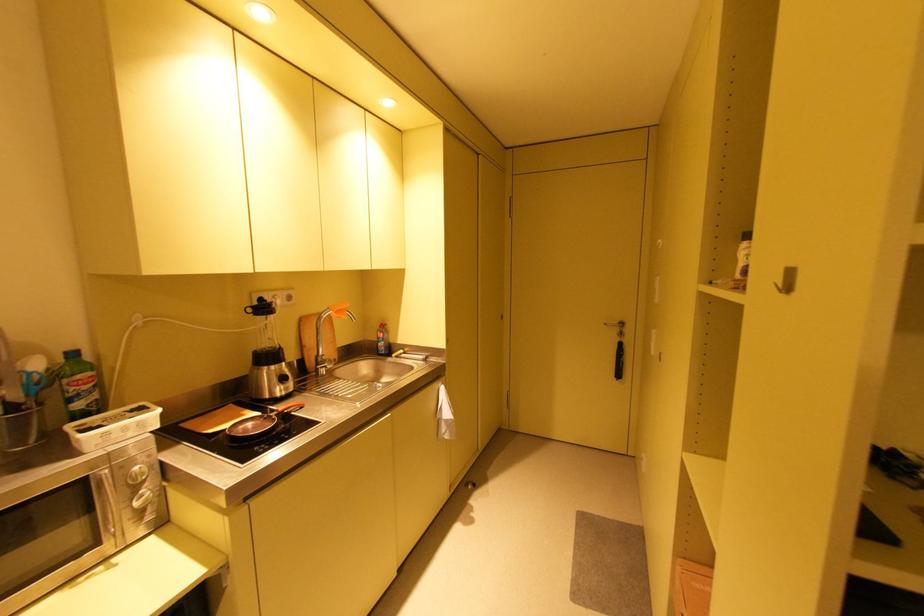
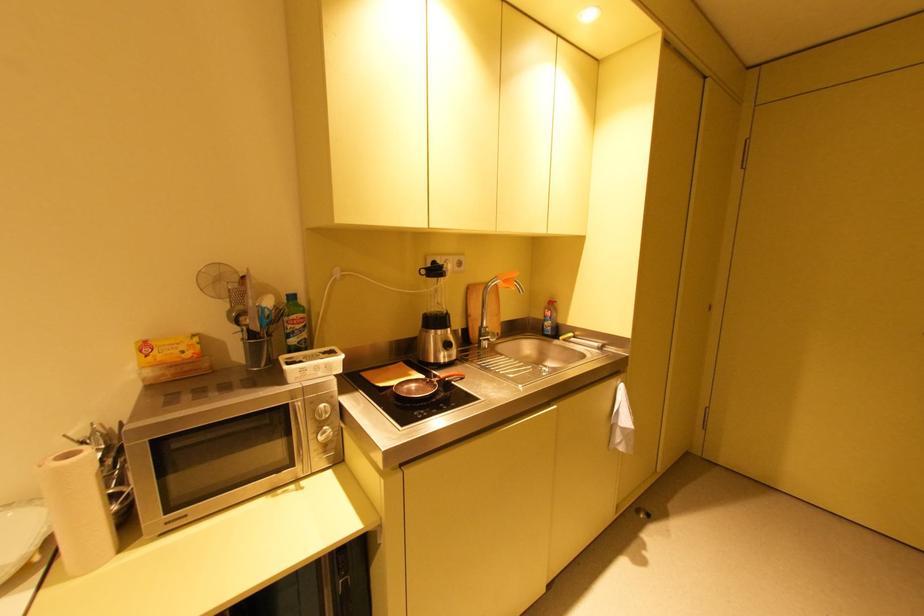
Where in the second image is the point corresponding to (x=34, y=375) from the first image?

(268, 310)